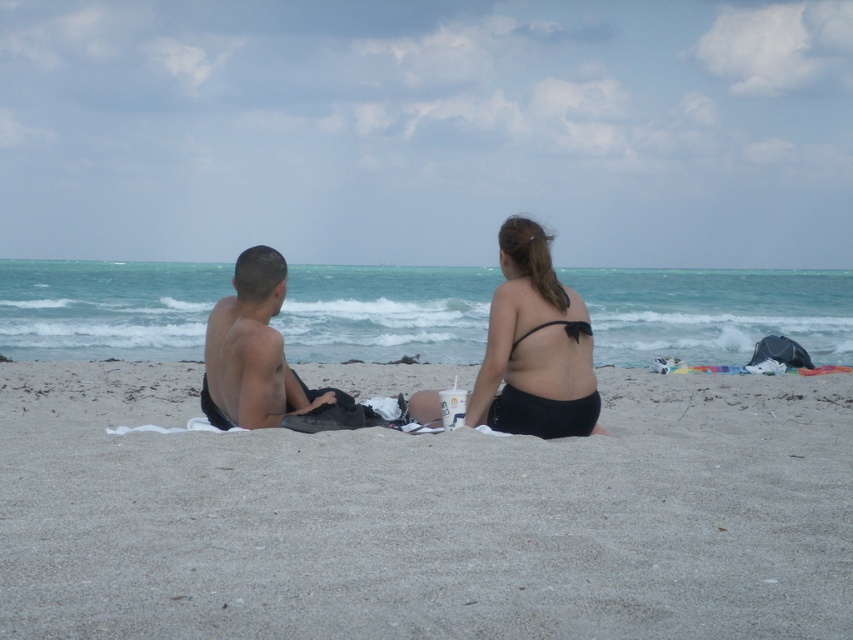
You are a photographer setting up a shot of the beach scene. You need to place a small prop exactly between the smooth sand at center and the black matte bikini top at center. Based on their positions, where should you position the prop?

The smooth sand at center is to the left of the black matte bikini top at center, so you should place the prop midway between the two objects along the horizontal axis.

You are a lifeguard observing the beach scene. You need to determine which object is taller between the smooth sand at center and the black matte bikini top at center. Which one is taller?

The smooth sand at center is taller than the black matte bikini top at center according to the description.

You are standing on the beach and want to place a small toy boat exactly where the smooth sand at center is located. According to the coordinates provided, where should you place it?

You should place the small toy boat at point (425, 516) where the smooth sand at center is located.